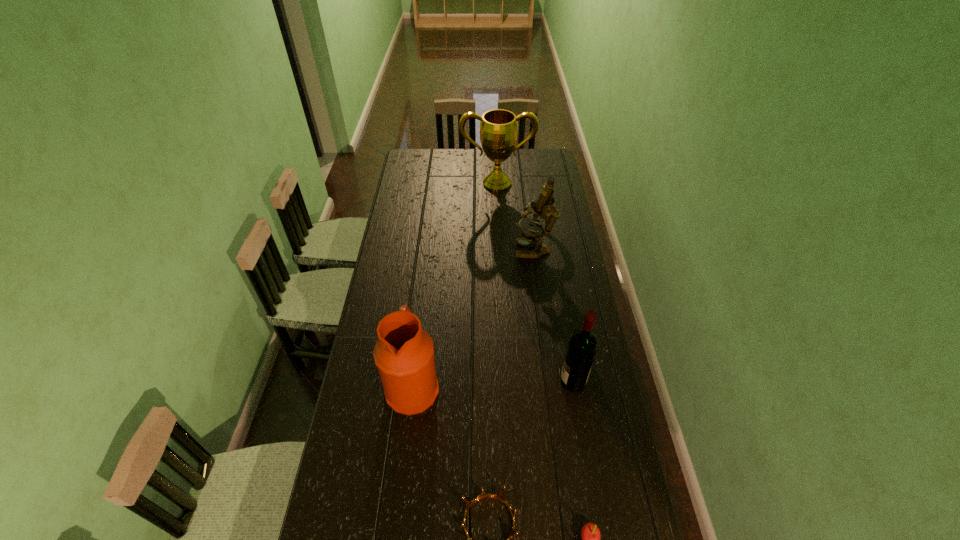
In order to click on object that is at the left edge in this screenshot , I will do `click(404, 353)`.

The height and width of the screenshot is (540, 960). I want to click on award that is at the right edge, so click(498, 128).

Locate an element on the screen. This screenshot has height=540, width=960. microscope present at the right edge is located at coordinates (544, 208).

This screenshot has height=540, width=960. I want to click on alcohol situated at the right edge, so click(583, 344).

You are a GUI agent. You are given a task and a screenshot of the screen. Output one action in this format:
    pyautogui.click(x=<x>, y=<y>)
    Task: Click on the vacant space at the left edge of the desktop
    This screenshot has width=960, height=540.
    Given the screenshot: What is the action you would take?
    pyautogui.click(x=416, y=237)

Where is `vacant area at the right edge of the desktop`? This screenshot has width=960, height=540. vacant area at the right edge of the desktop is located at coordinates (582, 295).

This screenshot has height=540, width=960. I want to click on free space at the far left corner, so pyautogui.click(x=431, y=166).

This screenshot has width=960, height=540. I want to click on empty space between the alcohol and the second farthest object, so click(x=554, y=316).

The image size is (960, 540). What are the coordinates of `unoccupied area between the alcohol and the fifth nearest object` in the screenshot? It's located at (554, 316).

The height and width of the screenshot is (540, 960). I want to click on unoccupied area between the alcohol and the leftmost object, so click(492, 384).